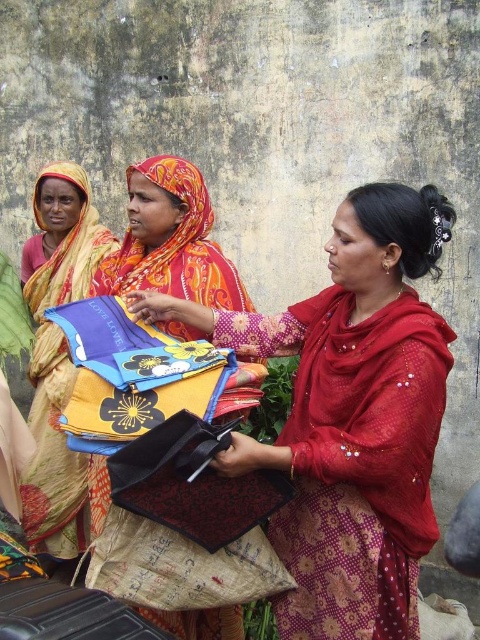
Question: Which object appears farthest from the camera in this image?

Choices:
 (A) floral silk shawl at center
 (B) matte red saree at center
 (C) red sheer saree at center

Answer: (A)

Question: Can you confirm if red sheer saree at center is positioned to the right of floral silk shawl at center?

Choices:
 (A) no
 (B) yes

Answer: (B)

Question: Which object appears closest to the camera in this image?

Choices:
 (A) matte red saree at center
 (B) floral silk shawl at center

Answer: (A)

Question: Considering the real-world distances, which object is farthest from the floral silk shawl at center?

Choices:
 (A) matte red saree at center
 (B) matte yellow sari at left
 (C) floral fabric scarf at center
 (D) red sheer saree at center

Answer: (D)

Question: Is the position of matte red saree at center more distant than that of red sheer saree at center?

Choices:
 (A) yes
 (B) no

Answer: (B)

Question: Can you confirm if matte red saree at center is wider than matte yellow sari at left?

Choices:
 (A) no
 (B) yes

Answer: (B)